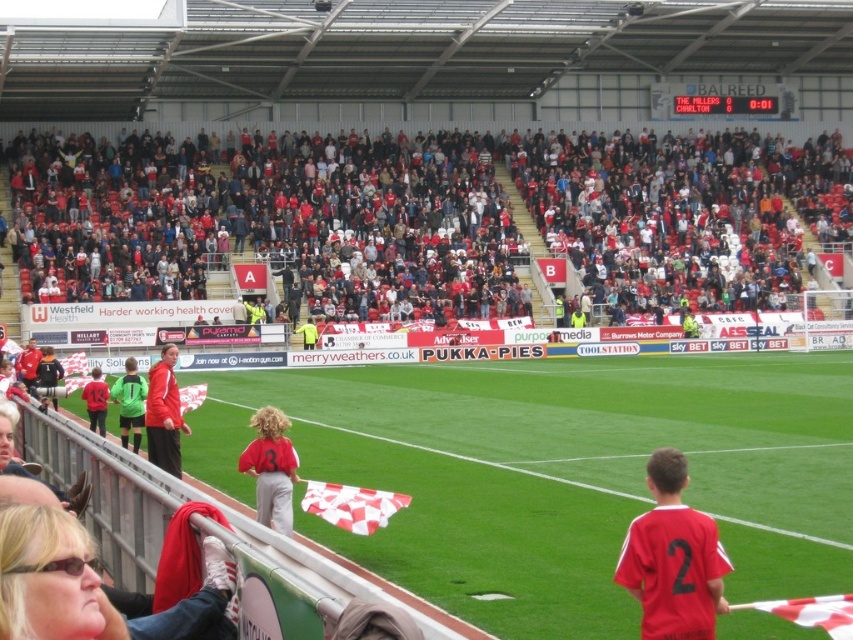
In the scene shown: You are sitting in the stadium and looking at the field. There are two points marked on the field at coordinates point (276, 419) and point (178, 467). Which point is closer to your view?

Point (276, 419) is closer to the camera than point (178, 467), so the point closer to your view is point (276, 419).

You are a spectator at the football stadium and want to locate two specific jackets in the stands. You see the red jacket at center and the matte black jacket at left. Which jacket is positioned more to the left side of the scene?

The matte black jacket at left is positioned more to the left side of the scene because the red jacket at center is to the right of it.

You are a photographer at the football stadium and need to capture a clear shot of both the matte red jersey at center and the red jacket at center. Which object should you focus on first if you want to ensure both are in focus without adjusting the camera settings?

The matte red jersey at center is positioned under the red jacket at center. To ensure both are in focus, you should focus on the matte red jersey at center first since it is closer to the camera, allowing the red jacket at center to be within the depth of field.